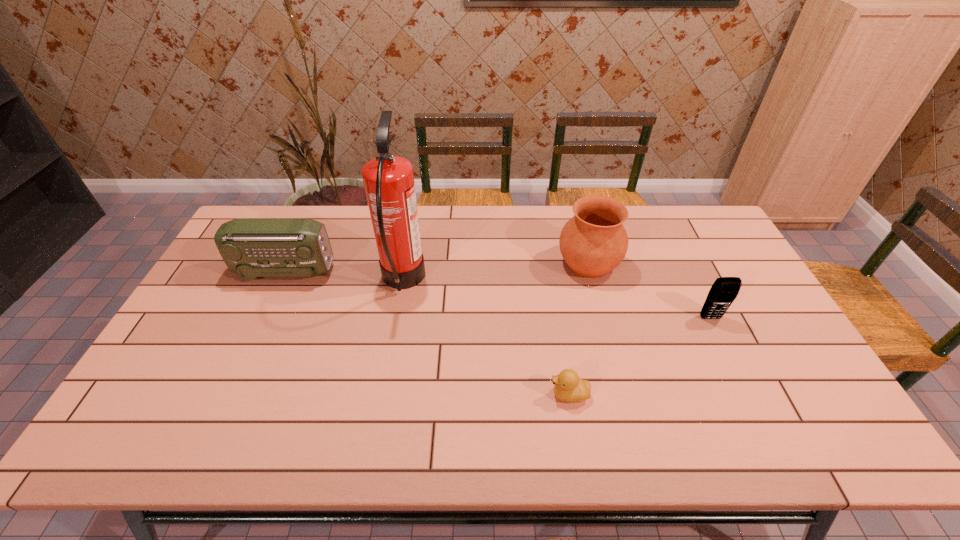
You are a GUI agent. You are given a task and a screenshot of the screen. Output one action in this format:
    pyautogui.click(x=<x>, y=<y>)
    Task: Click on the tallest object
    This screenshot has height=540, width=960.
    Given the screenshot: What is the action you would take?
    click(x=388, y=180)

At what (x,y) coordinates should I click in order to perform the action: click on the second object from left to right. Please return your answer as a coordinate pair (x, y). This screenshot has height=540, width=960. Looking at the image, I should click on (388, 180).

The height and width of the screenshot is (540, 960). In order to click on pottery in this screenshot , I will do `click(593, 242)`.

Identify the location of radio_receiver. This screenshot has width=960, height=540. (251, 247).

Locate an element on the screen. The width and height of the screenshot is (960, 540). the fourth farthest object is located at coordinates (724, 290).

At what (x,y) coordinates should I click in order to perform the action: click on the rightmost object. Please return your answer as a coordinate pair (x, y). This screenshot has width=960, height=540. Looking at the image, I should click on (724, 290).

Find the location of a particular element. This screenshot has width=960, height=540. the nearest object is located at coordinates (568, 387).

I want to click on the shortest object, so click(568, 387).

Where is `free space located 0.310m on the front-facing side of the fire extinguisher`? The image size is (960, 540). free space located 0.310m on the front-facing side of the fire extinguisher is located at coordinates (522, 281).

The height and width of the screenshot is (540, 960). I want to click on vacant space located 0.050m on the right of the pottery, so click(x=636, y=264).